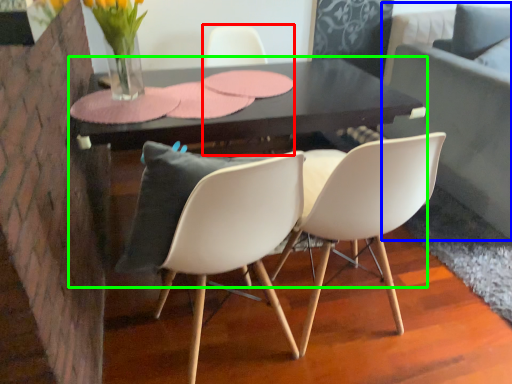
Question: Which object is the closest to the chair (highlighted by a red box)? Choose among these: couch (highlighted by a blue box) or table (highlighted by a green box).

Choices:
 (A) couch
 (B) table

Answer: (B)